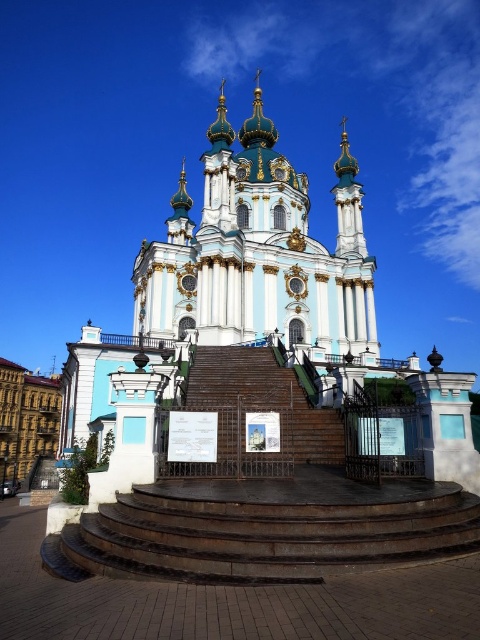
Question: Which point appears farthest from the camera in this image?

Choices:
 (A) (308, 524)
 (B) (108, 401)
 (C) (236, 358)

Answer: (C)

Question: From the image, what is the correct spatial relationship of white marble church at center in relation to brown wooden stairs at center?

Choices:
 (A) right
 (B) left

Answer: (A)

Question: Does dark brown stone stairs at center come behind brown wooden stairs at center?

Choices:
 (A) no
 (B) yes

Answer: (A)

Question: Which point is farther from the camera taking this photo?

Choices:
 (A) (224, 381)
 (B) (179, 316)

Answer: (B)

Question: Which object appears farthest from the camera in this image?

Choices:
 (A) brown wooden stairs at center
 (B) white marble church at center
 (C) dark brown stone stairs at center

Answer: (A)

Question: Does white marble church at center have a lesser width compared to dark brown stone stairs at center?

Choices:
 (A) yes
 (B) no

Answer: (B)